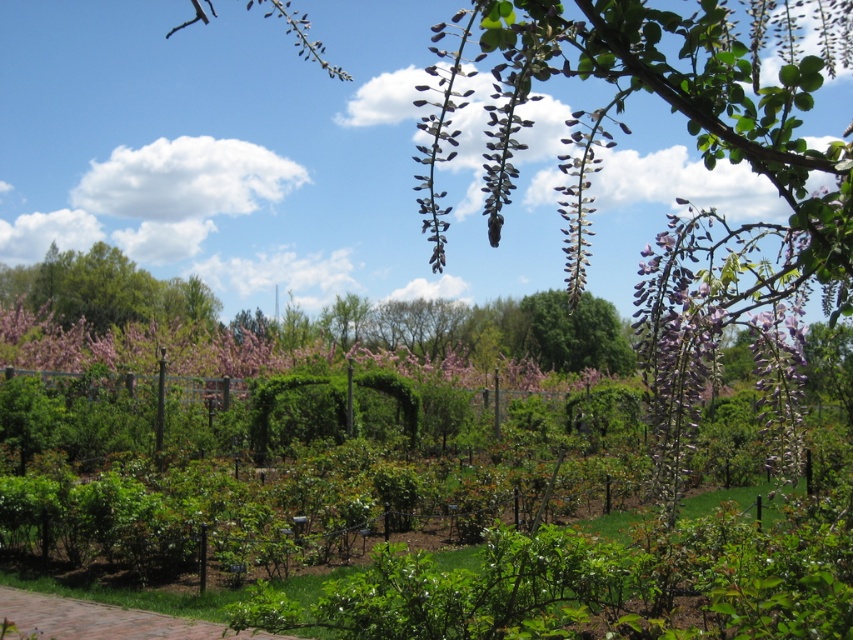
Question: Does pink matte flowers at center have a greater width compared to brick paved path at lower center?

Choices:
 (A) yes
 (B) no

Answer: (A)

Question: Which point is farther to the camera?

Choices:
 (A) green leafy tree at center
 (B) pink matte flowers at center
 (C) brick paved path at lower center

Answer: (B)

Question: Is green leafy tree at upper left wider than green leafy tree at center?

Choices:
 (A) yes
 (B) no

Answer: (B)

Question: Does pink matte flowers at center have a greater width compared to green leafy tree at center?

Choices:
 (A) yes
 (B) no

Answer: (A)

Question: Which object is the farthest from the brick paved path at lower center?

Choices:
 (A) pink matte flowers at center
 (B) green leafy tree at upper left

Answer: (B)

Question: Which is farther from the green leafy tree at center?

Choices:
 (A) green leafy tree at upper left
 (B) pink matte flowers at center

Answer: (A)